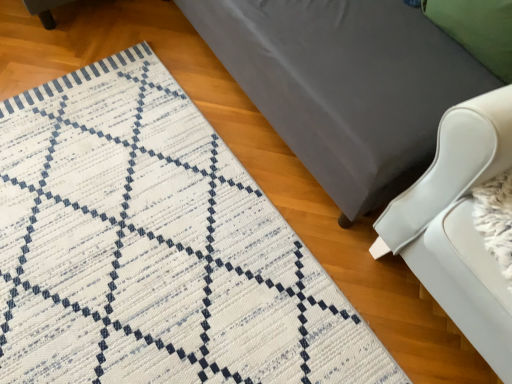
In order to face white woven mat at lower left, should I rotate leftwards or rightwards?

You should look left and rotate roughly 16.516 degrees.

The width and height of the screenshot is (512, 384). What do you see at coordinates (155, 248) in the screenshot?
I see `white woven mat at lower left` at bounding box center [155, 248].

You are a GUI agent. You are given a task and a screenshot of the screen. Output one action in this format:
    pyautogui.click(x=<x>, y=<y>)
    Task: Click on the matte gray bed at center
    The width and height of the screenshot is (512, 384).
    Given the screenshot: What is the action you would take?
    pyautogui.click(x=345, y=85)

This screenshot has height=384, width=512. Find the location of `green fabric pillow at upper right`. green fabric pillow at upper right is located at coordinates (478, 29).

From a real-world perspective, is white woven mat at lower left located beneath green fabric pillow at upper right?

Yes, from a real-world perspective, white woven mat at lower left is beneath green fabric pillow at upper right.

Is white woven mat at lower left inside or outside of green fabric pillow at upper right?

white woven mat at lower left is spatially situated outside green fabric pillow at upper right.

Consider the image. Does white woven mat at lower left have a lesser width compared to green fabric pillow at upper right?

In fact, white woven mat at lower left might be wider than green fabric pillow at upper right.

Based on the photo, from the image's perspective, is white woven mat at lower left below green fabric pillow at upper right?

Yes, from the image's perspective, white woven mat at lower left is beneath green fabric pillow at upper right.

Consider the image. Is green fabric pillow at upper right next to white woven mat at lower left?

No, green fabric pillow at upper right is not next to white woven mat at lower left.

Is green fabric pillow at upper right in front of or behind white woven mat at lower left in the image?

green fabric pillow at upper right is positioned farther from the viewer than white woven mat at lower left.

How different are the orientations of green fabric pillow at upper right and white woven mat at lower left in degrees?

0.526 degrees separate the facing orientations of green fabric pillow at upper right and white woven mat at lower left.

Image resolution: width=512 pixels, height=384 pixels. I want to click on mat behind the matte gray bed at center, so click(x=155, y=248).

What's the angular difference between white woven mat at lower left and matte gray bed at center's facing directions?

The angular difference between white woven mat at lower left and matte gray bed at center is 1.84 degrees.

Considering the sizes of objects white woven mat at lower left and matte gray bed at center in the image provided, who is taller, white woven mat at lower left or matte gray bed at center?

matte gray bed at center.

Which of these two, white woven mat at lower left or matte gray bed at center, is bigger?

Bigger between the two is matte gray bed at center.

Looking at this image, is matte gray bed at center with white woven mat at lower left?

matte gray bed at center and white woven mat at lower left are clearly separated.

Does point (371, 56) come in front of point (69, 73)?

Yes, it is.

Considering the sizes of objects matte gray bed at center and white woven mat at lower left in the image provided, who is wider, matte gray bed at center or white woven mat at lower left?

With larger width is white woven mat at lower left.

Is matte gray bed at center positioned with its back to white woven mat at lower left?

No, white woven mat at lower left is not at the back of matte gray bed at center.

Between matte gray bed at center and green fabric pillow at upper right, which one appears on the right side from the viewer's perspective?

Positioned to the right is green fabric pillow at upper right.

Would you say matte gray bed at center contains green fabric pillow at upper right?

Indeed, green fabric pillow at upper right is located within matte gray bed at center.

Which object is more forward, matte gray bed at center or green fabric pillow at upper right?

matte gray bed at center is more forward.

Between point (298, 15) and point (499, 50), which one is positioned in front?

The point (499, 50) is in front.

Considering the sizes of objects green fabric pillow at upper right and matte gray bed at center in the image provided, who is smaller, green fabric pillow at upper right or matte gray bed at center?

Smaller between the two is green fabric pillow at upper right.

How distant is green fabric pillow at upper right from matte gray bed at center?

green fabric pillow at upper right is 11.21 inches from matte gray bed at center.

From the picture: Is matte gray bed at center a part of green fabric pillow at upper right?

Actually, matte gray bed at center is outside green fabric pillow at upper right.

Find the location of `pillow above the white woven mat at lower left (from the image's perspective)`. pillow above the white woven mat at lower left (from the image's perspective) is located at coordinates (478, 29).

Where is `pillow behind the white woven mat at lower left`? pillow behind the white woven mat at lower left is located at coordinates (478, 29).

From the image, which object appears to be farther from matte gray bed at center, green fabric pillow at upper right or white woven mat at lower left?

The object further to matte gray bed at center is white woven mat at lower left.

From the image, which object appears to be farther from green fabric pillow at upper right, matte gray bed at center or white woven mat at lower left?

white woven mat at lower left lies further to green fabric pillow at upper right than the other object.

Estimate the real-world distances between objects in this image. Which object is closer to white woven mat at lower left, green fabric pillow at upper right or matte gray bed at center?

Based on the image, matte gray bed at center appears to be nearer to white woven mat at lower left.

Which object lies further to the anchor point matte gray bed at center, white woven mat at lower left or green fabric pillow at upper right?

white woven mat at lower left lies further to matte gray bed at center than the other object.

Looking at the image, which one is located further to green fabric pillow at upper right, white woven mat at lower left or matte gray bed at center?

The object further to green fabric pillow at upper right is white woven mat at lower left.

Looking at the image, which one is located further to white woven mat at lower left, matte gray bed at center or green fabric pillow at upper right?

green fabric pillow at upper right is positioned further to the anchor white woven mat at lower left.

The height and width of the screenshot is (384, 512). Identify the location of furniture situated between white woven mat at lower left and green fabric pillow at upper right from left to right. (345, 85).